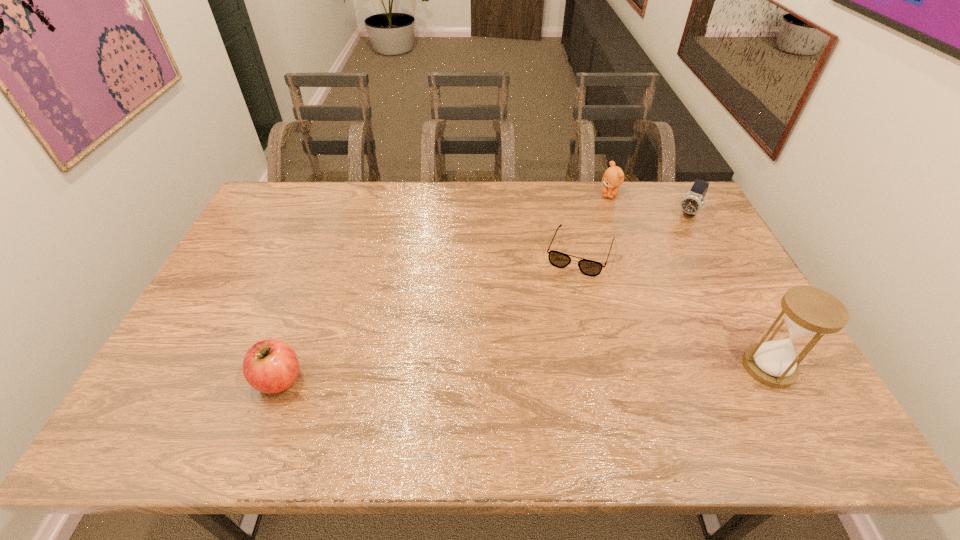
You are a GUI agent. You are given a task and a screenshot of the screen. Output one action in this format:
    pyautogui.click(x=<x>, y=<y>)
    Task: Click on the apple present at the near edge
    
    Given the screenshot: What is the action you would take?
    pyautogui.click(x=270, y=366)

You are a GUI agent. You are given a task and a screenshot of the screen. Output one action in this format:
    pyautogui.click(x=<x>, y=<y>)
    Task: Click on the hourglass situated at the near edge
    This screenshot has height=540, width=960.
    Given the screenshot: What is the action you would take?
    pyautogui.click(x=808, y=312)

This screenshot has height=540, width=960. Identify the location of hourglass present at the right edge. (808, 312).

Where is `watch at the right edge`? watch at the right edge is located at coordinates (691, 203).

At what (x,y) coordinates should I click in order to perform the action: click on object that is positioned at the far right corner. Please return your answer as a coordinate pair (x, y). Looking at the image, I should click on (691, 203).

Where is `object at the near right corner`? Image resolution: width=960 pixels, height=540 pixels. object at the near right corner is located at coordinates (808, 312).

At what (x,y) coordinates should I click in order to perform the action: click on free space at the far edge. Please return your answer as a coordinate pair (x, y). Looking at the image, I should click on (354, 207).

In order to click on vacant area at the near edge of the desktop in this screenshot , I will do `click(239, 394)`.

In the image, there is a desktop. Identify the location of vacant space at the left edge. (240, 245).

Identify the location of free space at the right edge of the desktop. This screenshot has width=960, height=540. (738, 279).